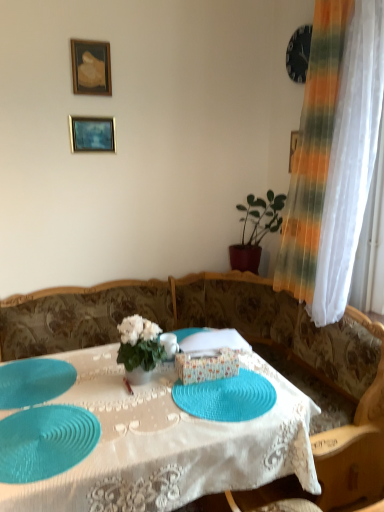
This screenshot has height=512, width=384. Find the location of `vacant space behind teal rubber placemat at lower left, positioned as the 2th glass plate in left-to-right order`. vacant space behind teal rubber placemat at lower left, positioned as the 2th glass plate in left-to-right order is located at coordinates (72, 391).